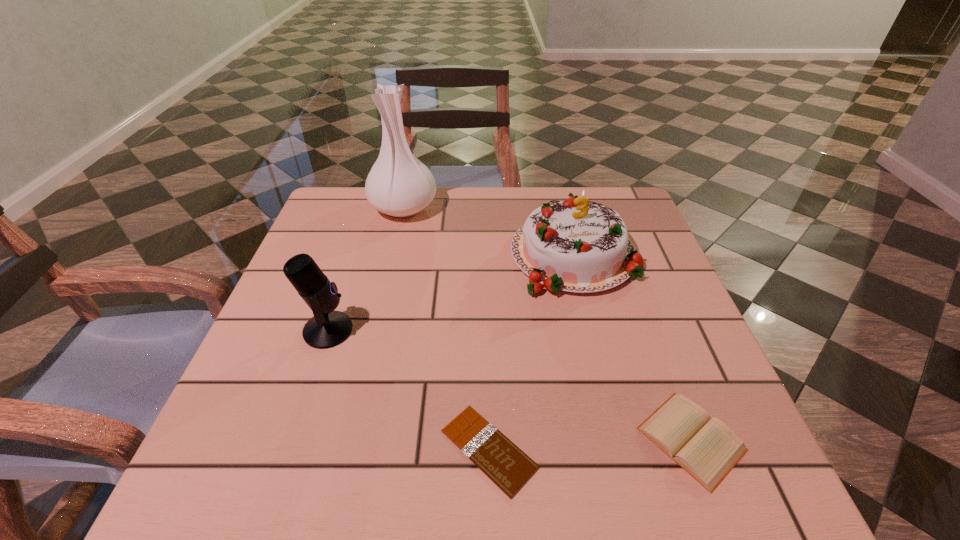
Image resolution: width=960 pixels, height=540 pixels. In order to click on object that is positioned at the near right corner in this screenshot , I will do `click(707, 449)`.

Where is `vacant space at the far edge of the desktop`? vacant space at the far edge of the desktop is located at coordinates (501, 199).

In the image, there is a desktop. In order to click on vacant space at the near edge in this screenshot , I will do coord(544,454).

Find the location of a particular element. The width and height of the screenshot is (960, 540). free spot at the left edge of the desktop is located at coordinates (329, 248).

The height and width of the screenshot is (540, 960). I want to click on vacant position at the right edge of the desktop, so click(690, 350).

Locate an element on the screen. The image size is (960, 540). vacant area at the far left corner of the desktop is located at coordinates (348, 232).

Where is `empty space that is in between the fourth tallest object and the tallest object`? This screenshot has height=540, width=960. empty space that is in between the fourth tallest object and the tallest object is located at coordinates (547, 323).

Locate an element on the screen. This screenshot has height=540, width=960. unoccupied position between the cake and the chocolate bar is located at coordinates (531, 352).

This screenshot has height=540, width=960. Find the location of `vacant space that's between the vase and the cake`. vacant space that's between the vase and the cake is located at coordinates (489, 231).

Where is `free area in between the fourth tallest object and the microphone`? The width and height of the screenshot is (960, 540). free area in between the fourth tallest object and the microphone is located at coordinates (510, 384).